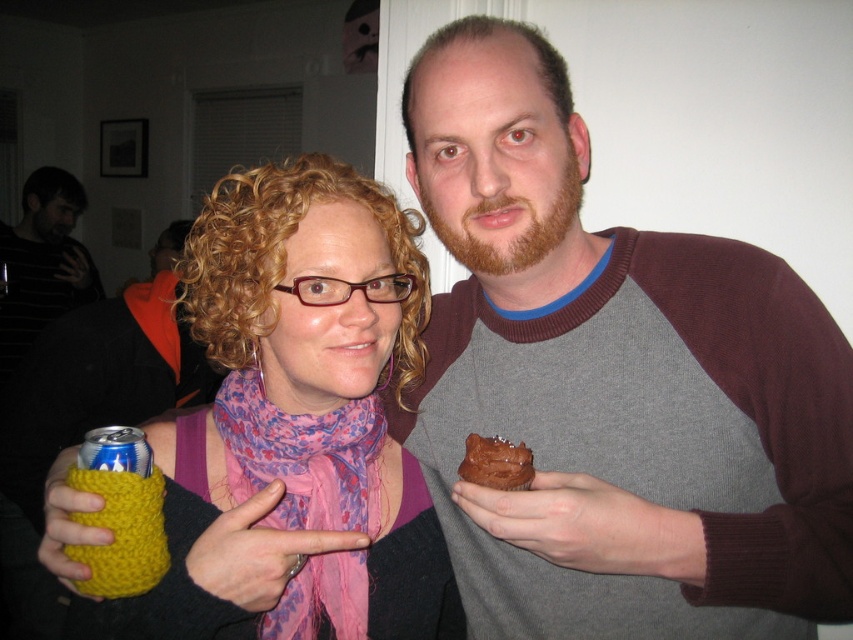
Based on the photo, you are organizing a photo album and want to ensure that the yellow knitted can at left and the pink floral scarf at center are placed in the correct order based on their sizes. Which object should come first if arranging them from largest to smallest?

The yellow knitted can at left should come first since it has a larger size compared to the pink floral scarf at center.

You are standing in the room where the two people are posing. You want to place a small plant between the two points marked as point (199, 328) and point (308, 609). Which point should the plant be closer to in order to be closer to the viewer?

The plant should be closer to point (199, 328) because it is closer to the viewer than point (308, 609).

From the picture: You are a photographer standing 1 meter away from the gray marled sweater at center and the chocolate matte cake at center. Can you fit both objects in your camera frame if your camera has a maximum field of view width of 30 centimeters?

The distance between the gray marled sweater at center and chocolate matte cake at center is 21.19 centimeters, which is less than the camera frame width of 30 centimeters. Therefore, both objects can be captured in the frame.